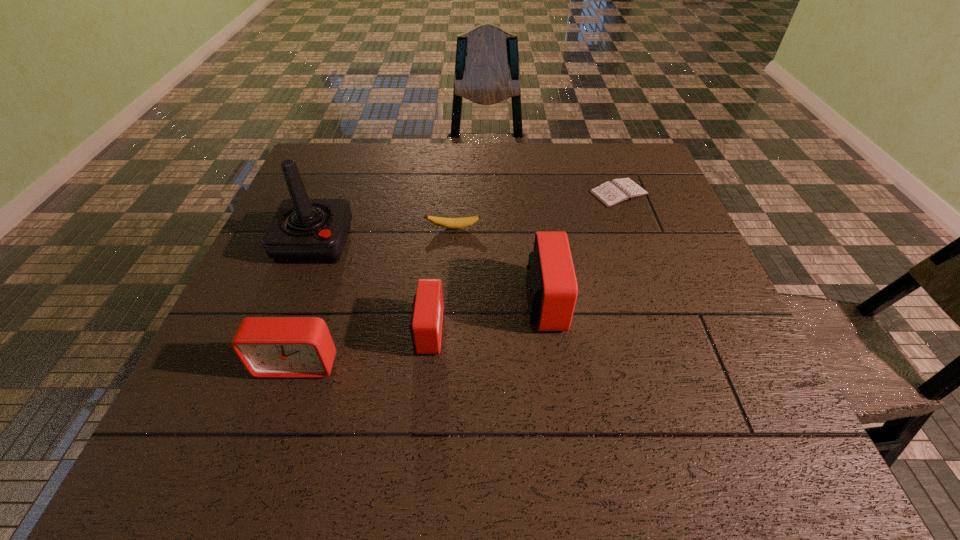
You are a GUI agent. You are given a task and a screenshot of the screen. Output one action in this format:
    pyautogui.click(x=<x>, y=<y>)
    Task: Click on the object positioned at the far right corner
    This screenshot has height=540, width=960.
    Given the screenshot: What is the action you would take?
    pyautogui.click(x=617, y=191)

Find the location of a particular element. This screenshot has height=540, width=960. vacant space at the far edge is located at coordinates [x=426, y=164].

Find the location of a particular element. The image size is (960, 540). blank area at the near edge is located at coordinates (406, 400).

Locate an element on the screen. The height and width of the screenshot is (540, 960). vacant area at the left edge is located at coordinates (316, 277).

The height and width of the screenshot is (540, 960). Identify the location of free space at the right edge of the desktop. (676, 320).

Image resolution: width=960 pixels, height=540 pixels. Identify the location of free region at the far left corner. (307, 169).

I want to click on vacant area at the far right corner of the desktop, so click(636, 181).

At what (x,y) coordinates should I click in order to perform the action: click on vacant region at the near right corner. Please return your answer as a coordinate pair (x, y). This screenshot has width=960, height=540. Looking at the image, I should click on (756, 372).

Locate an element on the screen. free space between the third tallest object and the tallest object is located at coordinates (306, 303).

Identify the location of empty location between the joystick and the fifth object from left to right. (430, 273).